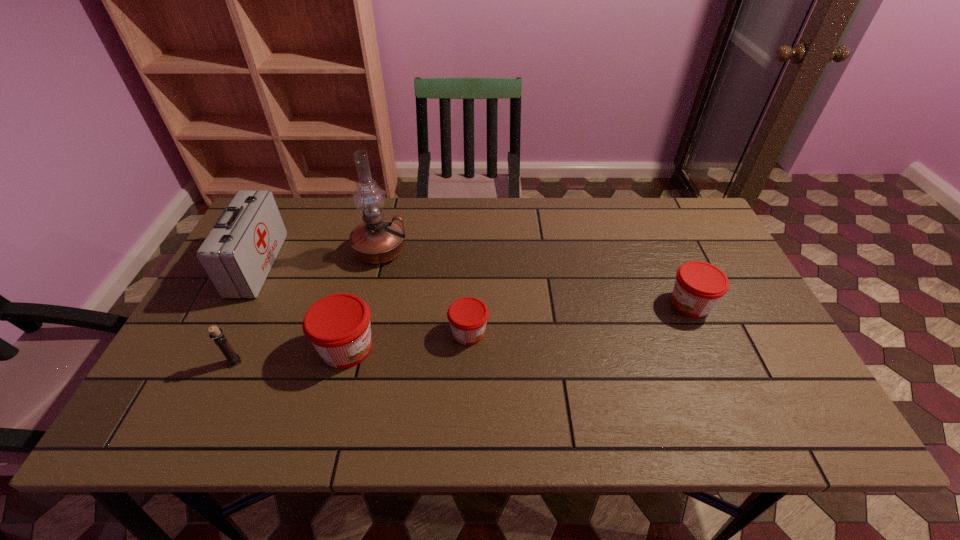
This screenshot has width=960, height=540. I want to click on free space between the second tallest object and the second shortest jam, so click(474, 284).

At what (x,y) coordinates should I click in order to perform the action: click on object that stands as the third closest to the second object from left to right. Please return your answer as a coordinate pair (x, y). Looking at the image, I should click on (377, 240).

Select which object is the fourth closest to the oil lamp. Please provide its 2D coordinates. Your answer should be formatted as a tuple, i.e. [(x, y)], where the tuple contains the x and y coordinates of a point satisfying the conditions above.

[(233, 359)]

The width and height of the screenshot is (960, 540). Identify the location of the third closest jam to the oil lamp. (699, 286).

Identify which jam is the closest to the rightmost object. Please provide its 2D coordinates. Your answer should be formatted as a tuple, i.e. [(x, y)], where the tuple contains the x and y coordinates of a point satisfying the conditions above.

[(467, 316)]